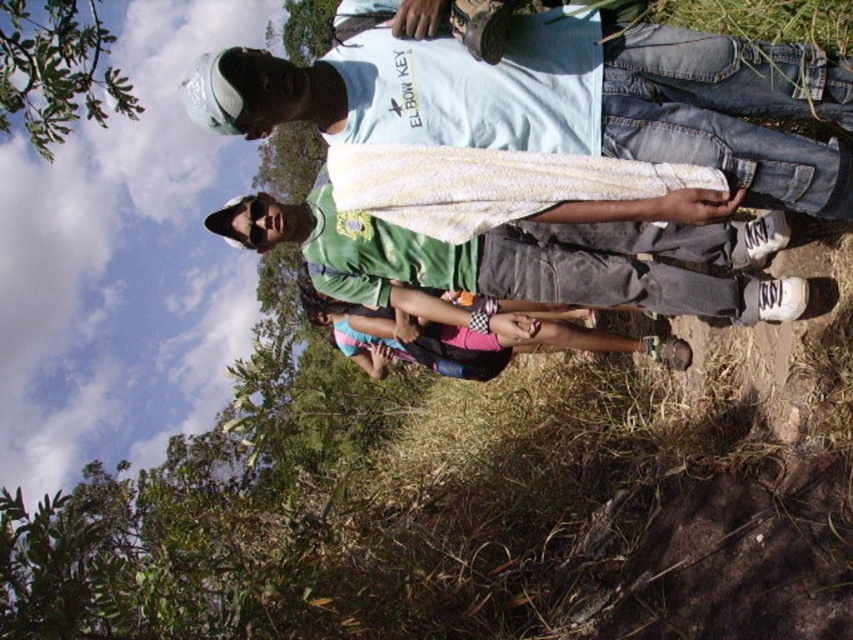
Question: Among these objects, which one is farthest from the camera?

Choices:
 (A) green grass at lower right
 (B) white textured towel at center
 (C) pink fabric at center
 (D) green fabric shirt at center

Answer: (C)

Question: Is green fabric shirt at center positioned behind green grass at lower right?

Choices:
 (A) yes
 (B) no

Answer: (A)

Question: Which of the following is the farthest from the observer?

Choices:
 (A) (114, 109)
 (B) (405, 268)
 (C) (782, 3)
 (D) (753, 97)

Answer: (A)

Question: Is green fabric shirt at center above pink fabric at center?

Choices:
 (A) no
 (B) yes

Answer: (B)

Question: Does green fabric shirt at center appear over green leafy tree at upper left?

Choices:
 (A) yes
 (B) no

Answer: (B)

Question: Which of these objects is positioned farthest from the green leafy tree at upper left?

Choices:
 (A) white textured towel at center
 (B) pink fabric at center
 (C) green fabric shirt at center
 (D) green grass at lower right

Answer: (D)